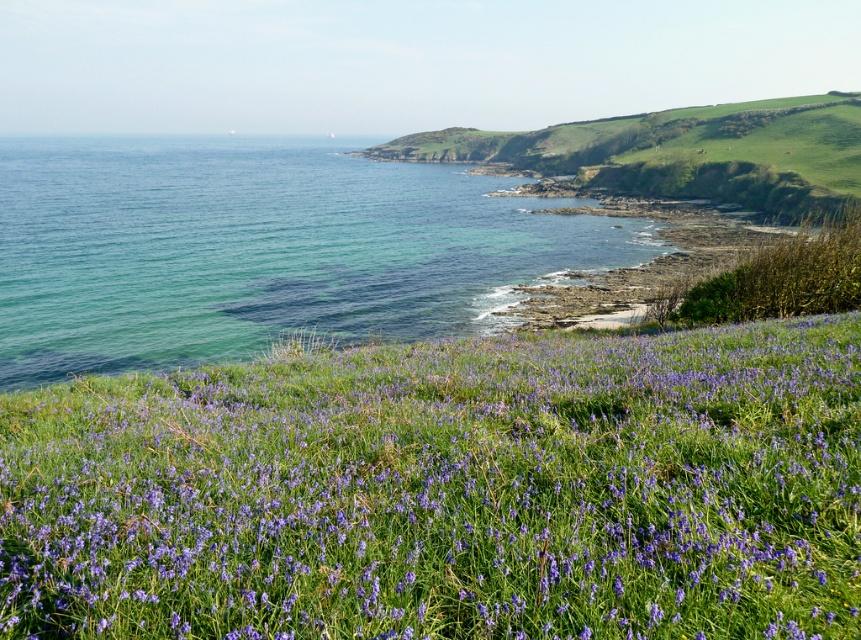
You are standing at the center of the image and want to pick some purple grass at center. Which direction should you move to reach it?

The purple grass at center is already at the center of the image, so you don t need to move in any direction to reach it.

You are standing at the edge of the purple flower field in the coastal landscape. There is a point marked at coordinates (448, 492). What is located at this point?

The point at coordinates (448, 492) marks the location of purple grass at center.

You are a hiker who wants to cross from the purple grass at center to the clear blue water at left. Given that your average walking pace is 1.5 meters per second, how many seconds will it take you to reach the water?

The distance between the purple grass at center and the clear blue water at left is 55.38 meters. At a walking pace of 1.5 meters per second, it would take approximately 36.92 seconds to reach the water. Since the question asks for the time in seconds, rounding to the nearest whole number gives about 37 seconds.